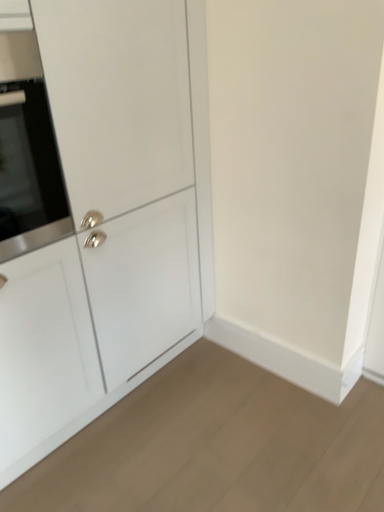
Question: Considering the relative positions of white matte cabinet at center and satin silver oven at left in the image provided, is white matte cabinet at center in front of satin silver oven at left?

Choices:
 (A) no
 (B) yes

Answer: (B)

Question: Can you confirm if white matte cabinet at center is bigger than satin silver oven at left?

Choices:
 (A) yes
 (B) no

Answer: (A)

Question: Does white matte cabinet at center have a greater height compared to satin silver oven at left?

Choices:
 (A) yes
 (B) no

Answer: (A)

Question: From a real-world perspective, is white matte cabinet at center physically below satin silver oven at left?

Choices:
 (A) no
 (B) yes

Answer: (B)

Question: Does white matte cabinet at center lie behind satin silver oven at left?

Choices:
 (A) no
 (B) yes

Answer: (A)

Question: Is white matte cabinet at center not close to satin silver oven at left?

Choices:
 (A) yes
 (B) no

Answer: (B)

Question: Does satin silver oven at left have a smaller size compared to white matte cabinet at center?

Choices:
 (A) no
 (B) yes

Answer: (B)

Question: Is satin silver oven at left to the right of white matte cabinet at center from the viewer's perspective?

Choices:
 (A) no
 (B) yes

Answer: (A)

Question: Can you confirm if satin silver oven at left is positioned to the left of white matte cabinet at center?

Choices:
 (A) no
 (B) yes

Answer: (B)

Question: Does satin silver oven at left have a greater height compared to white matte cabinet at center?

Choices:
 (A) no
 (B) yes

Answer: (A)

Question: Can you confirm if satin silver oven at left is wider than white matte cabinet at center?

Choices:
 (A) yes
 (B) no

Answer: (B)

Question: Is satin silver oven at left shorter than white matte cabinet at center?

Choices:
 (A) yes
 (B) no

Answer: (A)

Question: Would you say white matte cabinet at center is to the left or to the right of satin silver oven at left in the picture?

Choices:
 (A) right
 (B) left

Answer: (A)